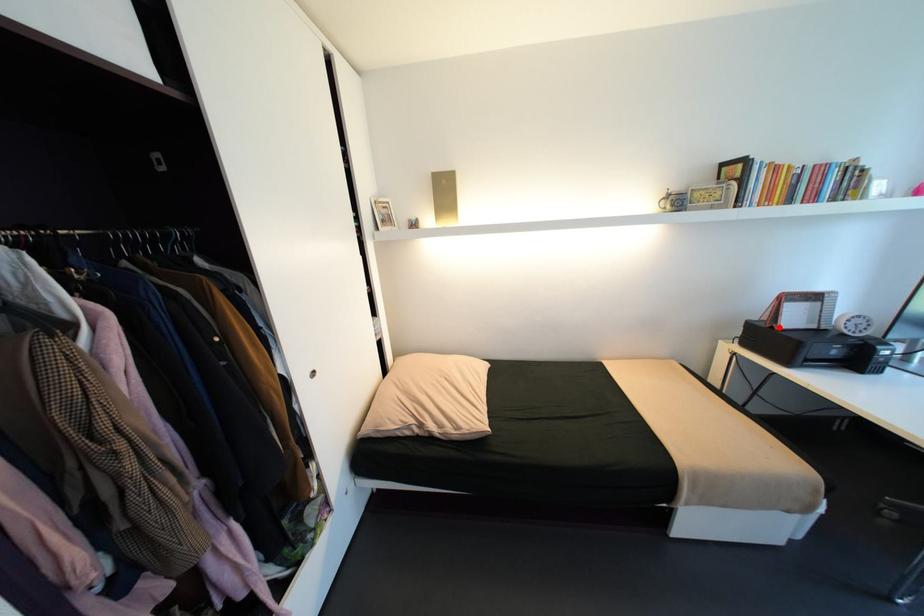
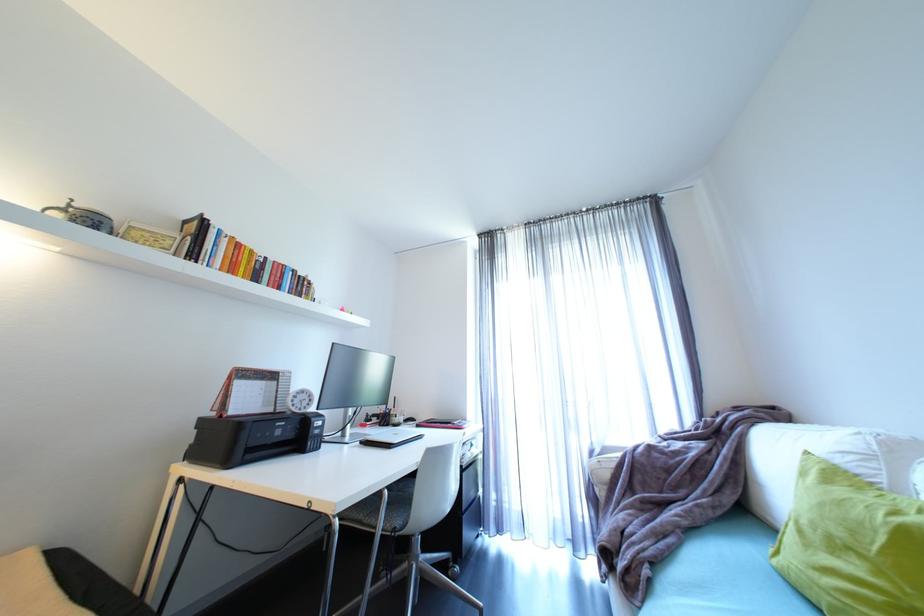
The point at the highlighted location is marked in the first image. Where is the corresponding point in the second image?

(228, 416)